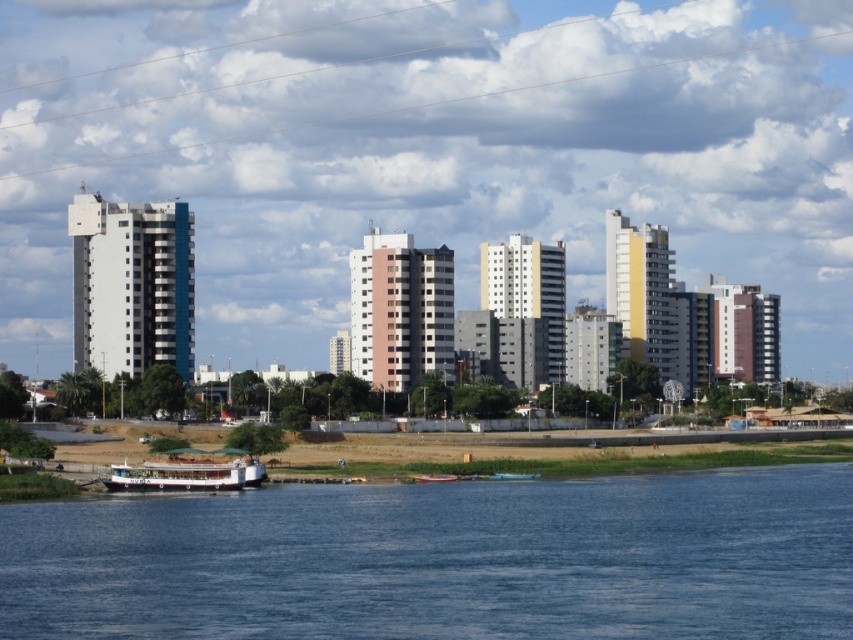
Question: Which object is closer to the camera taking this photo?

Choices:
 (A) metallic red boat at lower center
 (B) blue water at lower center
 (C) white matte boat at lower center

Answer: (B)

Question: Which point is farther to the camera?

Choices:
 (A) click(123, 480)
 (B) click(453, 582)

Answer: (A)

Question: Which of the following is the closest to the observer?

Choices:
 (A) (432, 480)
 (B) (490, 625)

Answer: (B)

Question: Can you confirm if white matte boat at lower center is bigger than metallic red boat at lower center?

Choices:
 (A) yes
 (B) no

Answer: (A)

Question: Does white matte boat at lower center have a lesser width compared to metallic red boat at lower center?

Choices:
 (A) yes
 (B) no

Answer: (B)

Question: Is blue water at lower center positioned before white matte boat at lower center?

Choices:
 (A) yes
 (B) no

Answer: (A)